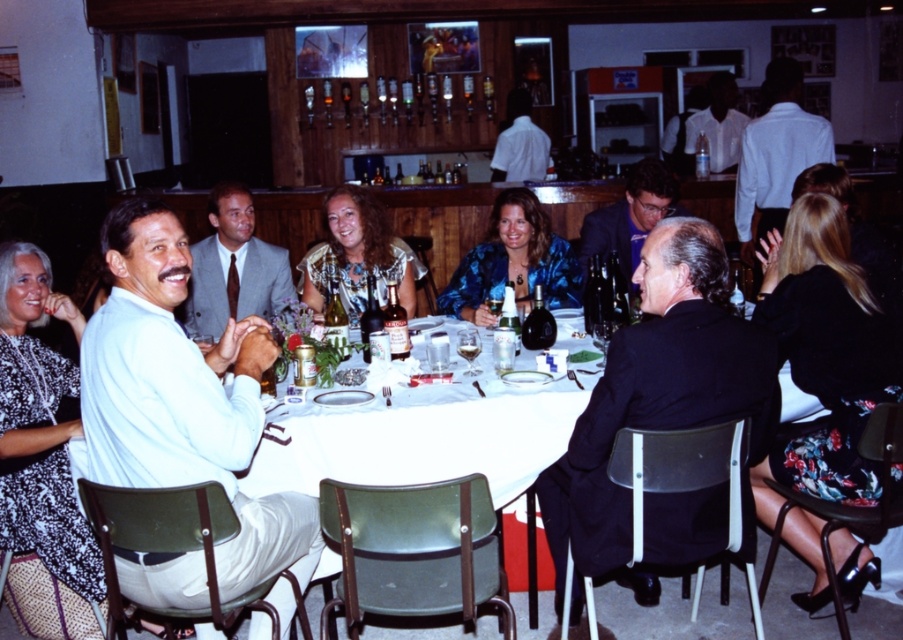
You are at the round table in the image and want to place a small vase between the two points labeled as point (450, 472) and point (355, 266). Since the vase is only 10 cm tall, will it be visible from your current position if placed at the closer point?

Point (450, 472) is closer to the viewer than point (355, 266). Since the vase is placed at the closer point, it will be more visible from your current position compared to the farther point.

You are a server at a restaurant who needs to place a 12 inch wide dessert plate on the table. The plate must be placed between the white plastic table at center and the blue textured jacket at center. Is there enough space to place the dessert plate between them?

The white plastic table at center and blue textured jacket at center are 31.18 inches apart. Since the dessert plate is 12 inches wide, there is sufficient space to place it between them as the distance between the two objects is greater than the plate width.